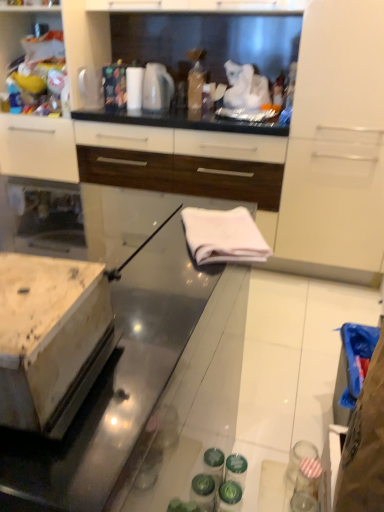
In the scene shown: Measure the distance between white glossy towel at center and camera.

They are 16.08 inches apart.

What do you see at coordinates (116, 383) in the screenshot?
I see `white glossy towel at center` at bounding box center [116, 383].

This screenshot has height=512, width=384. I want to click on white glossy cabinet at upper left, arranged as the 1th cabinetry when viewed from the left, so click(x=64, y=37).

Locate an element on the screen. Image resolution: width=384 pixels, height=512 pixels. white glossy electric kettle at upper center is located at coordinates (157, 88).

Based on the photo, is white glossy towel at center not within white fabric at center?

Yes, white glossy towel at center is outside of white fabric at center.

Considering the relative sizes of white glossy towel at center and white fabric at center in the image provided, is white glossy towel at center bigger than white fabric at center?

Yes, white glossy towel at center is bigger than white fabric at center.

Between point (121, 405) and point (265, 251), which one is positioned in front?

The point (121, 405) is in front.

Between white glossy towel at center and white fabric at center, which one appears on the left side from the viewer's perspective?

white glossy towel at center is more to the left.

Based on their positions, is white glossy cabinet at upper center, the 1th cabinetry from the right, located to the left or right of white fabric at center?

Clearly, white glossy cabinet at upper center, the 1th cabinetry from the right, is on the left of white fabric at center in the image.

Considering the relative sizes of white glossy cabinet at upper center, the 1th cabinetry from the right, and white fabric at center in the image provided, is white glossy cabinet at upper center, the 1th cabinetry from the right, taller than white fabric at center?

Indeed, white glossy cabinet at upper center, the 1th cabinetry from the right, has a greater height compared to white fabric at center.

Considering the sizes of objects white glossy cabinet at upper center, which appears as the 2th cabinetry when viewed from the left, and white fabric at center in the image provided, who is bigger, white glossy cabinet at upper center, which appears as the 2th cabinetry when viewed from the left, or white fabric at center?

Bigger between the two is white glossy cabinet at upper center, which appears as the 2th cabinetry when viewed from the left.

Would you say white glossy cabinet at upper center, the 1th cabinetry from the right, is inside or outside white fabric at center?

white glossy cabinet at upper center, the 1th cabinetry from the right, is spatially situated outside white fabric at center.

Is white fabric at center surrounding white glossy cabinet at upper left, arranged as the 1th cabinetry when viewed from the left?

Actually, white glossy cabinet at upper left, arranged as the 1th cabinetry when viewed from the left, is outside white fabric at center.

Where is `cloth lying in front of the white glossy cabinet at upper left, arranged as the 1th cabinetry when viewed from the left`? cloth lying in front of the white glossy cabinet at upper left, arranged as the 1th cabinetry when viewed from the left is located at coordinates (223, 236).

Is white fabric at center oriented towards white glossy cabinet at upper left, arranged as the 1th cabinetry when viewed from the left?

No, white fabric at center is not facing towards white glossy cabinet at upper left, arranged as the 1th cabinetry when viewed from the left.

Can you tell me how much white fabric at center and white glossy cabinet at upper left, arranged as the 1th cabinetry when viewed from the left, differ in facing direction?

65.2 degrees separate the facing orientations of white fabric at center and white glossy cabinet at upper left, arranged as the 1th cabinetry when viewed from the left.

Looking at this image, visually, is white glossy cabinet at upper center, the 1th cabinetry from the right, positioned to the left or to the right of white glossy cabinet at upper left, the second cabinetry viewed from the right?

Clearly, white glossy cabinet at upper center, the 1th cabinetry from the right, is on the right of white glossy cabinet at upper left, the second cabinetry viewed from the right, in the image.

Is white glossy cabinet at upper center, the 1th cabinetry from the right, not within white glossy cabinet at upper left, arranged as the 1th cabinetry when viewed from the left?

white glossy cabinet at upper center, the 1th cabinetry from the right, is positioned outside white glossy cabinet at upper left, arranged as the 1th cabinetry when viewed from the left.

From a real-world perspective, is white glossy cabinet at upper center, which appears as the 2th cabinetry when viewed from the left, positioned under white glossy cabinet at upper left, the second cabinetry viewed from the right, based on gravity?

Yes, from a real-world perspective, white glossy cabinet at upper center, which appears as the 2th cabinetry when viewed from the left, is under white glossy cabinet at upper left, the second cabinetry viewed from the right.

Is white glossy cabinet at upper center, the 1th cabinetry from the right, directly adjacent to white glossy cabinet at upper left, arranged as the 1th cabinetry when viewed from the left?

No, white glossy cabinet at upper center, the 1th cabinetry from the right, is not beside white glossy cabinet at upper left, arranged as the 1th cabinetry when viewed from the left.

Which object is further away from the camera, white fabric at center or white glossy towel at center?

white fabric at center is further from the camera.

Between white fabric at center and white glossy towel at center, which one appears on the left side from the viewer's perspective?

Positioned to the left is white glossy towel at center.

The height and width of the screenshot is (512, 384). I want to click on countertop that is under the white fabric at center (from a real-world perspective), so (116, 383).

Who is smaller, white fabric at center or white glossy towel at center?

Smaller between the two is white fabric at center.

Is white glossy electric kettle at upper center at the back of white fabric at center?

No, white fabric at center is not facing the opposite direction of white glossy electric kettle at upper center.

Is point (211, 240) closer or farther from the camera than point (144, 103)?

Point (211, 240) appears to be closer to the viewer than point (144, 103).

Considering the positions of objects white fabric at center and white glossy electric kettle at upper center in the image provided, who is behind, white fabric at center or white glossy electric kettle at upper center?

white glossy electric kettle at upper center is further from the camera.

Is white fabric at center placed right next to white glossy electric kettle at upper center?

No, white fabric at center is not making contact with white glossy electric kettle at upper center.

Based on their positions, is white glossy towel at center located to the left or right of white glossy cabinet at upper left, arranged as the 1th cabinetry when viewed from the left?

white glossy towel at center is to the right of white glossy cabinet at upper left, arranged as the 1th cabinetry when viewed from the left.

Between white glossy towel at center and white glossy cabinet at upper left, the second cabinetry viewed from the right, which one is positioned behind?

white glossy cabinet at upper left, the second cabinetry viewed from the right, is behind.

Who is shorter, white glossy towel at center or white glossy cabinet at upper left, the second cabinetry viewed from the right?

With less height is white glossy towel at center.

This screenshot has height=512, width=384. Find the location of `countertop below the white fabric at center (from the image's perspective)`. countertop below the white fabric at center (from the image's perspective) is located at coordinates (116, 383).

Identify the location of the 1st cabinetry counting from the left side of the white fabric at center. (167, 113).

From the image, which object appears to be farther from white glossy cabinet at upper center, the 1th cabinetry from the right, white glossy electric kettle at upper center or white glossy cabinet at upper left, arranged as the 1th cabinetry when viewed from the left?

Among the two, white glossy electric kettle at upper center is located further to white glossy cabinet at upper center, the 1th cabinetry from the right.

Considering their positions, is white glossy towel at center positioned further to white glossy cabinet at upper center, the 1th cabinetry from the right, than white glossy electric kettle at upper center?

white glossy towel at center lies further to white glossy cabinet at upper center, the 1th cabinetry from the right, than the other object.

Considering their positions, is white glossy towel at center positioned further to white fabric at center than white glossy cabinet at upper center, which appears as the 2th cabinetry when viewed from the left?

The object further to white fabric at center is white glossy cabinet at upper center, which appears as the 2th cabinetry when viewed from the left.

From the image, which object appears to be nearer to white glossy towel at center, white glossy electric kettle at upper center or white fabric at center?

white fabric at center.

Looking at the image, which one is located further to white glossy cabinet at upper center, which appears as the 2th cabinetry when viewed from the left, white glossy electric kettle at upper center or white fabric at center?

white fabric at center lies further to white glossy cabinet at upper center, which appears as the 2th cabinetry when viewed from the left, than the other object.

Looking at the image, which one is located closer to white fabric at center, white glossy cabinet at upper center, the 1th cabinetry from the right, or white glossy towel at center?

Based on the image, white glossy towel at center appears to be nearer to white fabric at center.

Which object lies nearer to the anchor point white glossy cabinet at upper left, the second cabinetry viewed from the right, white glossy towel at center or white glossy cabinet at upper center, which appears as the 2th cabinetry when viewed from the left?

white glossy cabinet at upper center, which appears as the 2th cabinetry when viewed from the left, is positioned closer to the anchor white glossy cabinet at upper left, the second cabinetry viewed from the right.

Estimate the real-world distances between objects in this image. Which object is closer to white glossy towel at center, white fabric at center or white glossy cabinet at upper left, arranged as the 1th cabinetry when viewed from the left?

white fabric at center.

At what (x,y) coordinates should I click in order to perform the action: click on cabinetry between white glossy cabinet at upper left, arranged as the 1th cabinetry when viewed from the left, and white glossy electric kettle at upper center from left to right. Please return your answer as a coordinate pair (x, y). Looking at the image, I should click on (167, 113).

You are a GUI agent. You are given a task and a screenshot of the screen. Output one action in this format:
    pyautogui.click(x=<x>, y=<y>)
    Task: Click on the cloth positioned between white glossy towel at center and white glossy electric kettle at upper center from near to far
    The image size is (384, 512).
    Given the screenshot: What is the action you would take?
    pyautogui.click(x=223, y=236)

Locate an element on the screen. The height and width of the screenshot is (512, 384). cloth located between white glossy towel at center and white glossy cabinet at upper center, the 1th cabinetry from the right, in the depth direction is located at coordinates (223, 236).

I want to click on cabinetry between white fabric at center and white glossy cabinet at upper left, the second cabinetry viewed from the right, along the z-axis, so click(x=167, y=113).